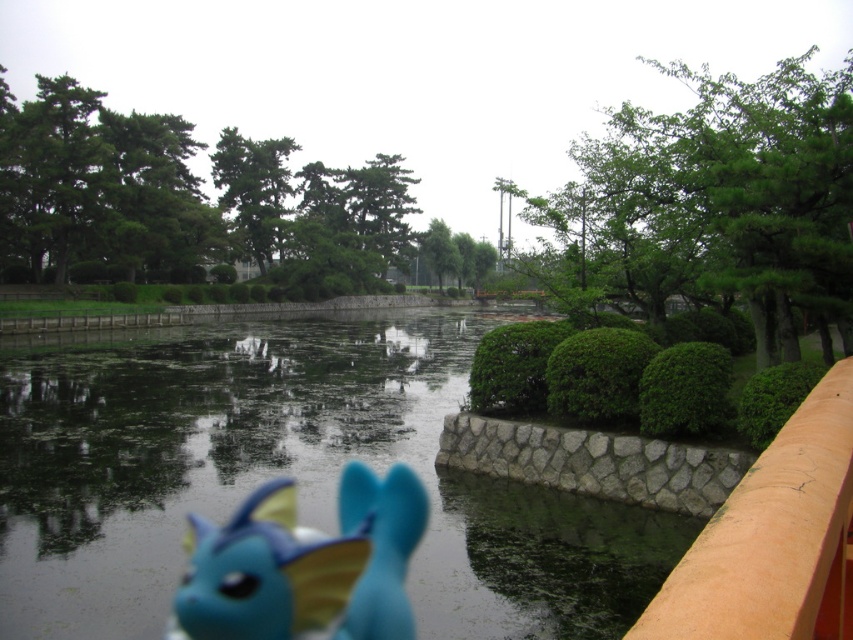
You are a photographer setting up a shot of the blue plush toy near the edge of the frame. You want to ensure the green matte tree at upper left and the green matte tree at upper center are both visible in the background. Which tree should you position closer to the top of the frame?

The green matte tree at upper center should be positioned closer to the top of the frame because the green matte tree at upper left is below it.

You are a photographer trying to capture a reflection of the green leafy tree at upper right in the water. Where should you position yourself relative to the blue matte plush toy at lower center to ensure the tree is reflected in the water?

To capture the reflection of the green leafy tree at upper right in the water, position yourself to the right of the blue matte plush toy at lower center since the tree is located to the right of the plush toy.

You are a photographer standing at the edge of the pond and want to capture a clear shot of the green matte tree at upper left. Given that your camera can focus up to 50 meters, will the tree be in focus?

The green matte tree at upper left is 55.59 meters away from the camera, which exceeds the camera focus limit of 50 meters. Therefore, the tree will not be in focus.